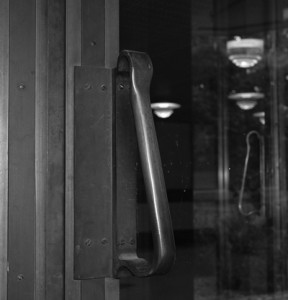
This screenshot has width=288, height=300. Identify the location of another handle. (249, 159).